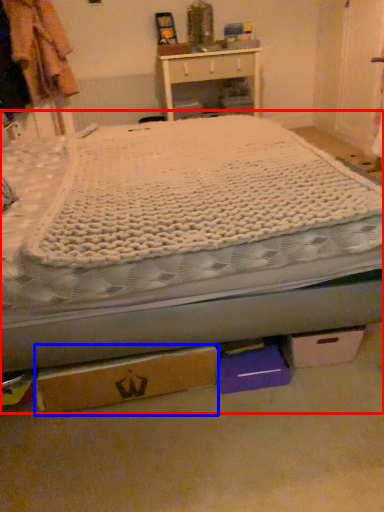
Question: Among these objects, which one is farthest to the camera, bed (highlighted by a red box) or cardboard box (highlighted by a blue box)?

Choices:
 (A) bed
 (B) cardboard box

Answer: (B)